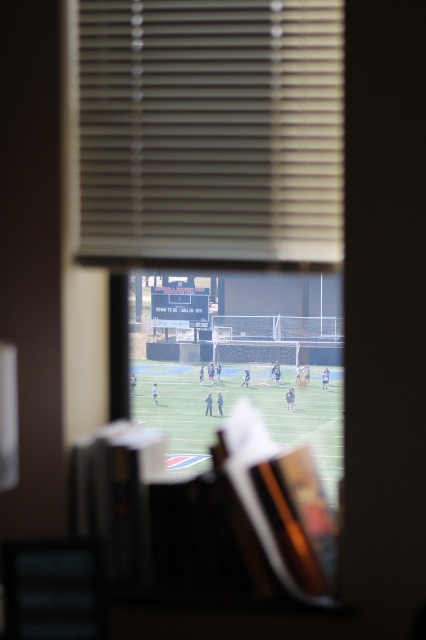
You are standing at the point marked as point (255,35) in a room with a window covered by horizontal blinds. The soccer field outside is visible through the window. If you want to see the entire soccer field clearly, would moving closer to the window help? Please explain your reasoning based on the distance between you and the window.

The point (255,35) is 11.33 feet away from the viewer. Moving closer to the window would reduce this distance, potentially allowing a clearer view of the soccer field through the blinds.